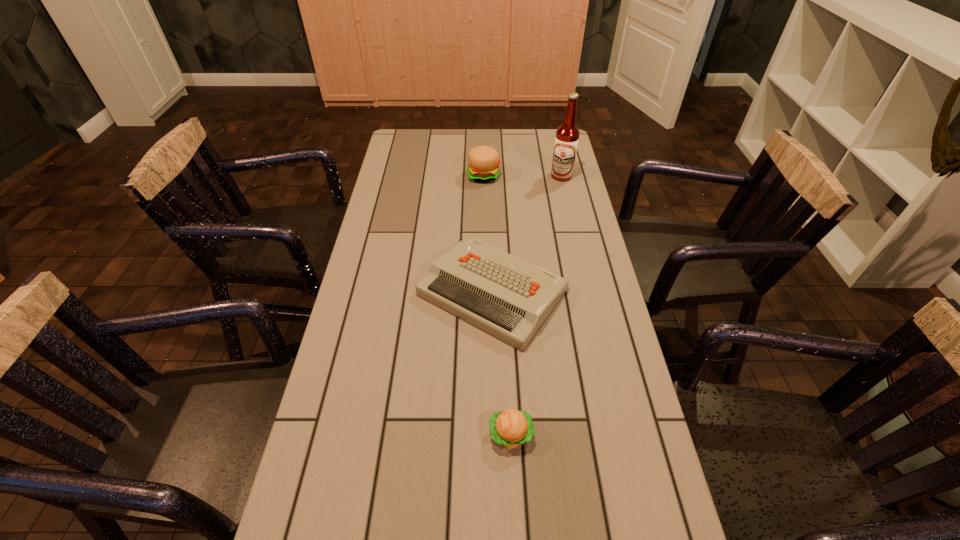
This screenshot has width=960, height=540. I want to click on free region located on the left of the second nearest object, so click(x=354, y=292).

Image resolution: width=960 pixels, height=540 pixels. Identify the location of alcohol located at the right edge. (567, 135).

I want to click on computer keyboard that is at the right edge, so click(505, 296).

You are a GUI agent. You are given a task and a screenshot of the screen. Output one action in this format:
    pyautogui.click(x=<x>, y=<y>)
    Task: Click on the free location at the far edge
    
    Given the screenshot: What is the action you would take?
    pyautogui.click(x=446, y=134)

This screenshot has height=540, width=960. Find the location of `vacant region at the left edge of the desktop`. vacant region at the left edge of the desktop is located at coordinates (316, 484).

The width and height of the screenshot is (960, 540). I want to click on vacant point at the right edge, so click(551, 238).

Find the location of a particular element. vacant area at the far left corner is located at coordinates (391, 154).

In the image, there is a desktop. Where is `vacant space at the far right corner`? vacant space at the far right corner is located at coordinates (535, 136).

Find the location of a particular element. The image size is (960, 540). unoccupied position between the alcohol and the third farthest object is located at coordinates (x=527, y=234).

Where is `vacant point located between the tallest object and the taller hamburger`? The height and width of the screenshot is (540, 960). vacant point located between the tallest object and the taller hamburger is located at coordinates (522, 176).